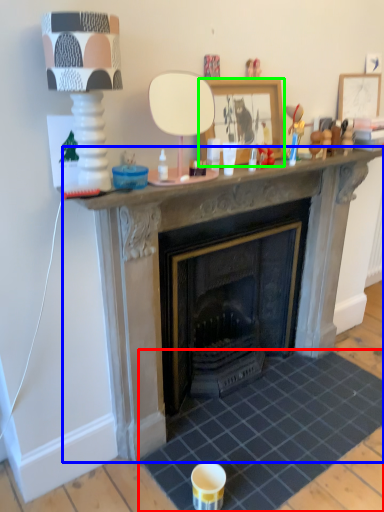
Question: Estimate the real-world distances between objects in this image. Which object is farther from tile (highlighted by a red box), fireplace (highlighted by a blue box) or picture frame (highlighted by a green box)?

Choices:
 (A) fireplace
 (B) picture frame

Answer: (B)